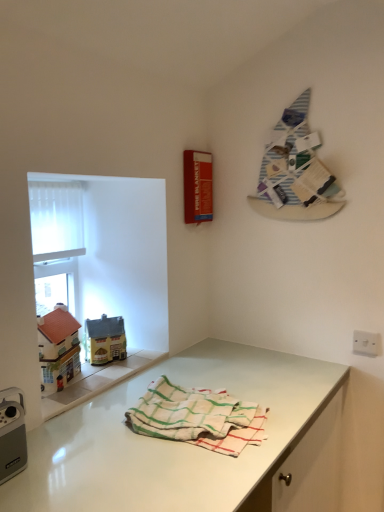
Question: Can you confirm if white woven towel at center is bigger than striped fabric at upper right?

Choices:
 (A) yes
 (B) no

Answer: (A)

Question: Is there a large distance between white woven towel at center and striped fabric at upper right?

Choices:
 (A) no
 (B) yes

Answer: (A)

Question: Could you tell me if white woven towel at center is turned towards striped fabric at upper right?

Choices:
 (A) no
 (B) yes

Answer: (A)

Question: Does white woven towel at center contain striped fabric at upper right?

Choices:
 (A) yes
 (B) no

Answer: (B)

Question: Can you confirm if white woven towel at center is positioned to the left of striped fabric at upper right?

Choices:
 (A) no
 (B) yes

Answer: (B)

Question: Is white woven towel at center outside striped fabric at upper right?

Choices:
 (A) no
 (B) yes

Answer: (B)

Question: Does white glossy countertop at lower center have a larger size compared to white woven towel at center?

Choices:
 (A) yes
 (B) no

Answer: (A)

Question: Can you confirm if white glossy countertop at lower center is wider than white woven towel at center?

Choices:
 (A) yes
 (B) no

Answer: (A)

Question: From a real-world perspective, is white glossy countertop at lower center located higher than white woven towel at center?

Choices:
 (A) no
 (B) yes

Answer: (A)

Question: Does white glossy countertop at lower center appear on the left side of white woven towel at center?

Choices:
 (A) yes
 (B) no

Answer: (A)

Question: Is white glossy countertop at lower center touching white woven towel at center?

Choices:
 (A) yes
 (B) no

Answer: (B)

Question: Is white woven towel at center at the back of white glossy countertop at lower center?

Choices:
 (A) no
 (B) yes

Answer: (A)

Question: Does white woven towel at center appear on the right side of white translucent screen at upper left?

Choices:
 (A) yes
 (B) no

Answer: (A)